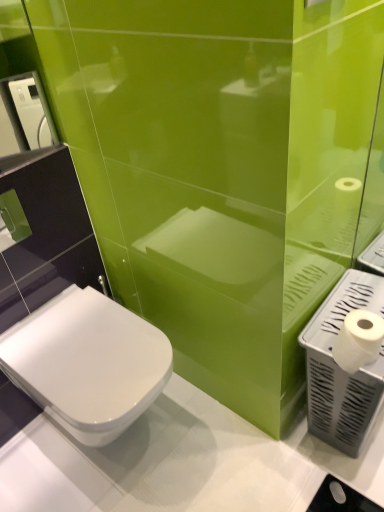
Locate an element on the screen. Image resolution: width=384 pixels, height=512 pixels. vacant space underneath white glossy toilet at lower left (from a real-world perspective) is located at coordinates (133, 446).